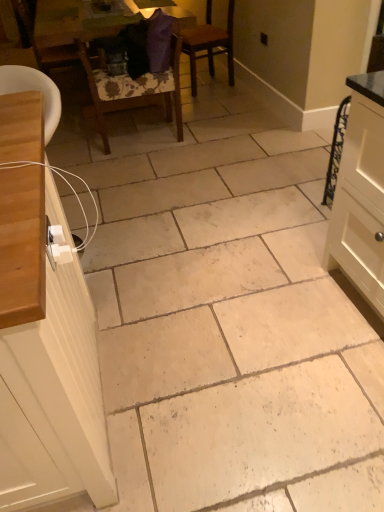
You are a GUI agent. You are given a task and a screenshot of the screen. Output one action in this format:
    pyautogui.click(x=<x>, y=<y>)
    Task: Click on the vacant region in front of brown wooden chair at center, arranged as the first chair when viewed from the right
    
    Given the screenshot: What is the action you would take?
    pyautogui.click(x=220, y=101)